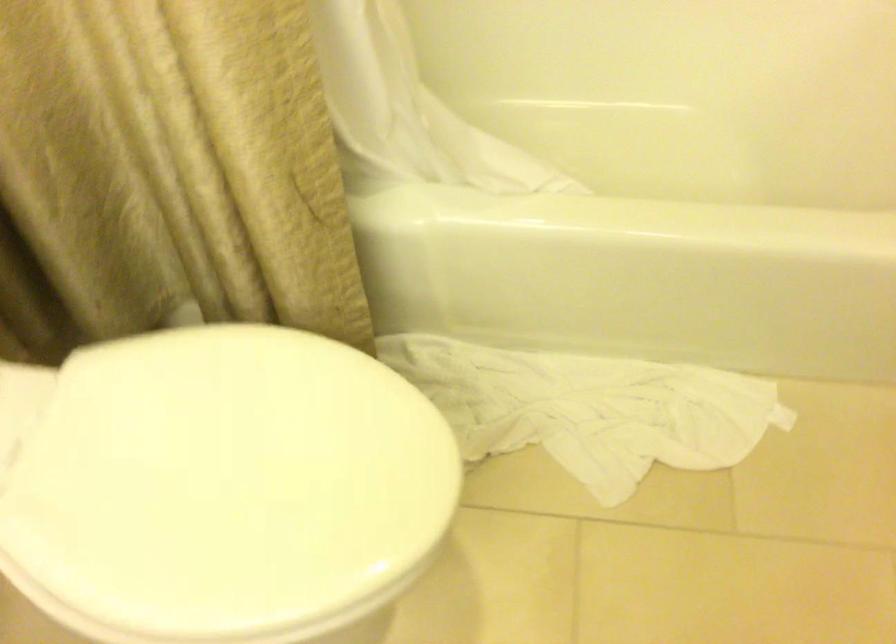
In order to click on white toilet lid in this screenshot , I will do `click(219, 484)`.